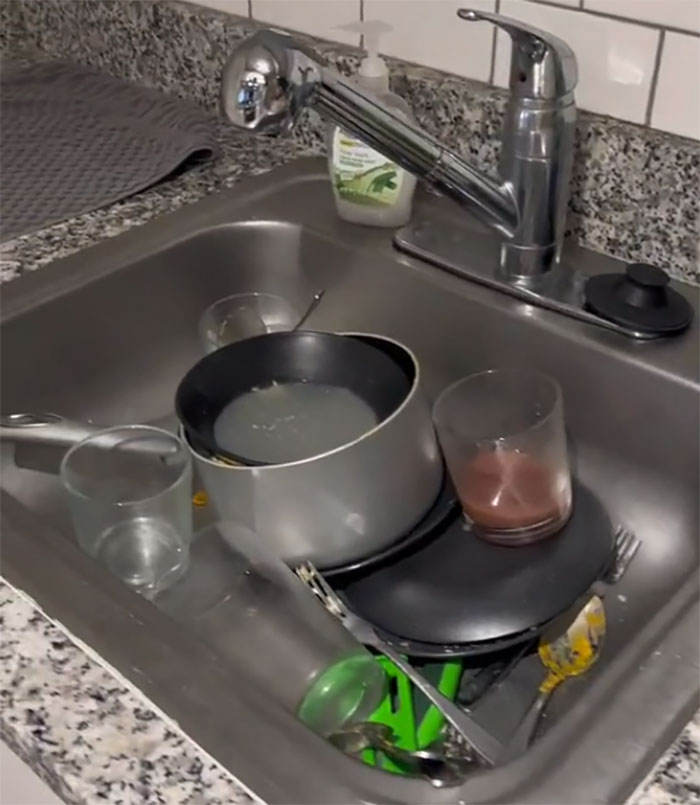
At what (x,y) coordinates should I click in order to perform the action: click on plate. Please return your answer as a coordinate pair (x, y). The height and width of the screenshot is (805, 700). Looking at the image, I should click on (453, 596), (423, 646).